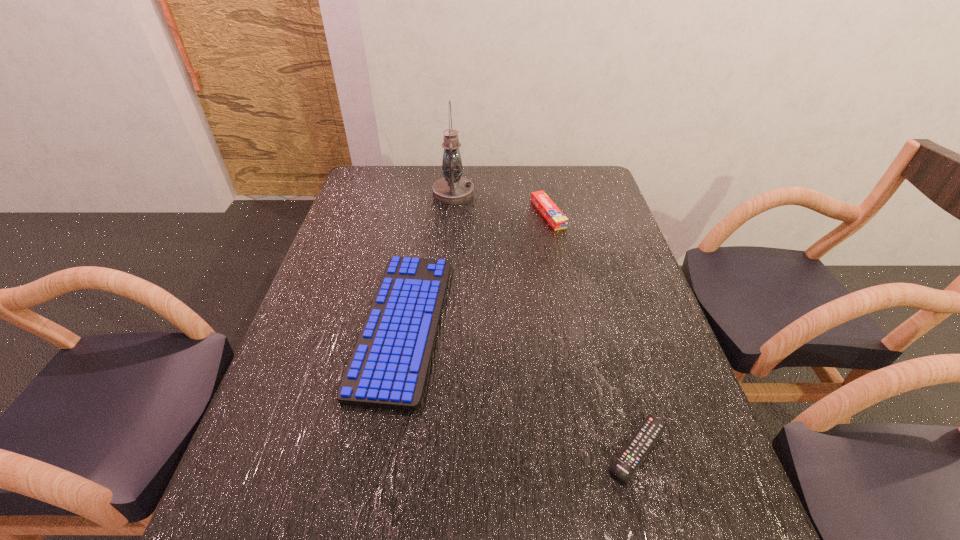
At what (x,y) coordinates should I click in order to perform the action: click on empty space that is in between the remote control and the third shortest object. Please return your answer as a coordinate pair (x, y). The height and width of the screenshot is (540, 960). Looking at the image, I should click on (593, 332).

Where is `vacant area between the toothpaste and the third tallest object`? This screenshot has width=960, height=540. vacant area between the toothpaste and the third tallest object is located at coordinates (475, 269).

This screenshot has height=540, width=960. Identify the location of blank region between the second shortest object and the shortest object. (520, 387).

The image size is (960, 540). Identify the location of vacant space that's between the toothpaste and the computer keyboard. (475, 269).

Find the location of a particular element. The width and height of the screenshot is (960, 540). free area in between the oil lamp and the toothpaste is located at coordinates (501, 204).

Find the location of `blank region between the second shortest object and the remote control`. blank region between the second shortest object and the remote control is located at coordinates (520, 387).

Find the location of a particular element. Image resolution: width=960 pixels, height=540 pixels. empty location between the third shortest object and the third farthest object is located at coordinates (475, 269).

Locate an element on the screen. The width and height of the screenshot is (960, 540). vacant region between the nearest object and the second nearest object is located at coordinates (520, 387).

What are the coordinates of `vacant region between the remote control and the computer keyboard` in the screenshot? It's located at pyautogui.click(x=520, y=387).

Identify which object is located as the third nearest to the remote control. Please provide its 2D coordinates. Your answer should be formatted as a tuple, i.e. [(x, y)], where the tuple contains the x and y coordinates of a point satisfying the conditions above.

[(452, 189)]